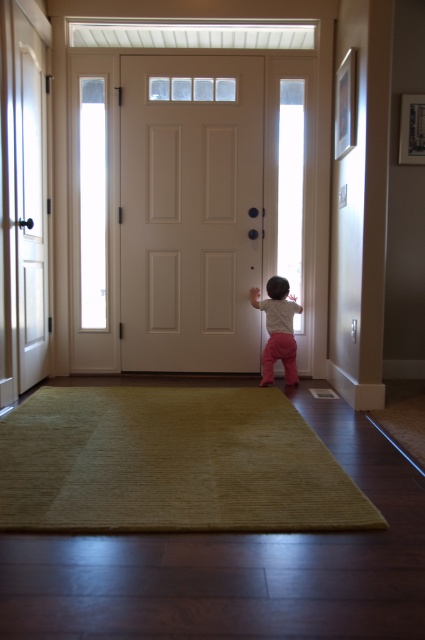
Question: Is white matte door at center bigger than pink fabric toddler at center?

Choices:
 (A) yes
 (B) no

Answer: (A)

Question: Does green soft rug at center appear on the left side of pink fabric toddler at center?

Choices:
 (A) no
 (B) yes

Answer: (B)

Question: Which point is closer to the camera?

Choices:
 (A) (238, 58)
 (B) (266, 348)

Answer: (B)

Question: Is white matte door at center to the right of pink fabric toddler at center from the viewer's perspective?

Choices:
 (A) no
 (B) yes

Answer: (A)

Question: Which object is the closest to the green soft rug at center?

Choices:
 (A) pink fabric toddler at center
 (B) white matte door at center

Answer: (A)

Question: Which is farther from the white matte door at center?

Choices:
 (A) pink fabric toddler at center
 (B) green soft rug at center

Answer: (B)